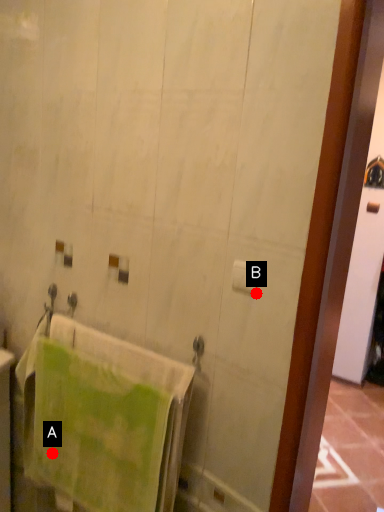
Question: Two points are circled on the image, labeled by A and B beside each circle. Which of the following is the farthest from the observer?

Choices:
 (A) A is further
 (B) B is further

Answer: (A)